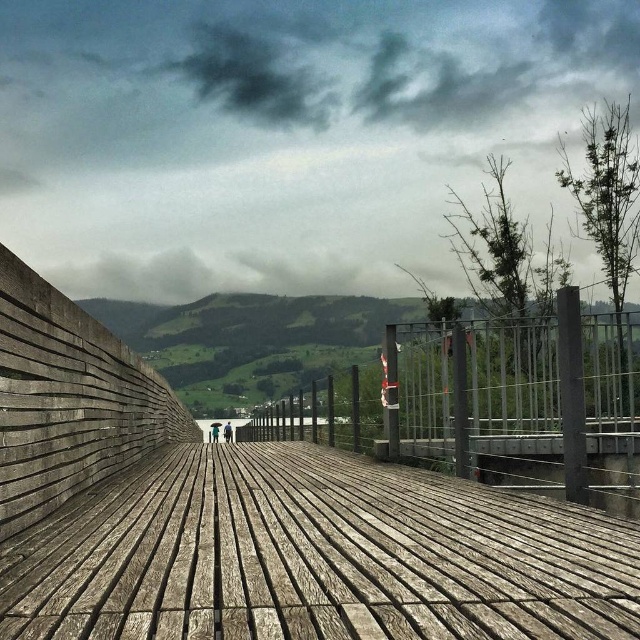
Can you confirm if weathered wood dock at center is bigger than metallic gray rail at center?

Actually, weathered wood dock at center might be smaller than metallic gray rail at center.

Is weathered wood dock at center thinner than metallic gray rail at center?

Indeed, weathered wood dock at center has a lesser width compared to metallic gray rail at center.

Where is `weathered wood dock at center`? weathered wood dock at center is located at coordinates (257, 518).

I want to click on weathered wood dock at center, so click(x=257, y=518).